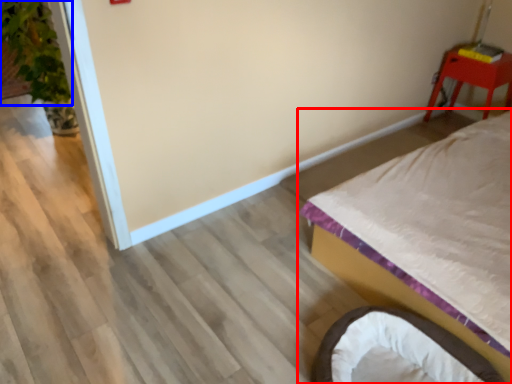
Question: Which object is closer to the camera taking this photo, bed (highlighted by a red box) or plant (highlighted by a blue box)?

Choices:
 (A) bed
 (B) plant

Answer: (A)